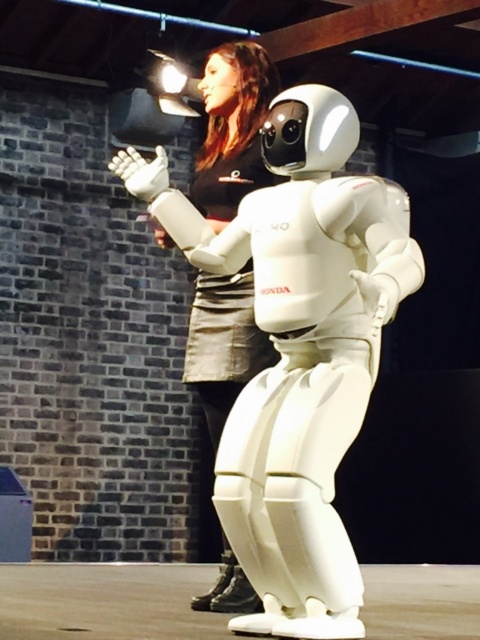
Question: Does matte black dress at upper center have a larger size compared to black matte dress at center?

Choices:
 (A) yes
 (B) no

Answer: (A)

Question: Does matte black dress at upper center appear on the right side of black matte dress at center?

Choices:
 (A) no
 (B) yes

Answer: (A)

Question: Which object is closer to the camera taking this photo?

Choices:
 (A) black matte dress at center
 (B) matte black dress at upper center

Answer: (A)

Question: Which of the following is the farthest from the observer?

Choices:
 (A) (240, 376)
 (B) (194, 376)

Answer: (B)

Question: Is the position of matte black dress at upper center more distant than that of black matte dress at center?

Choices:
 (A) yes
 (B) no

Answer: (A)